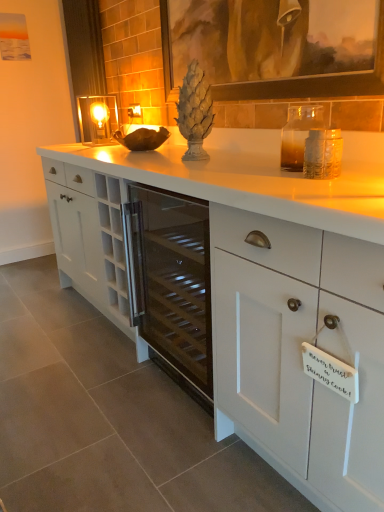
Question: From the image's perspective, does white matte cabinet at center appear lower than matte brown picture frame at upper center?

Choices:
 (A) yes
 (B) no

Answer: (A)

Question: From the image's perspective, is white matte cabinet at center located above matte brown picture frame at upper center?

Choices:
 (A) no
 (B) yes

Answer: (A)

Question: Does white matte cabinet at center have a greater width compared to matte brown picture frame at upper center?

Choices:
 (A) yes
 (B) no

Answer: (A)

Question: From a real-world perspective, is white matte cabinet at center below matte brown picture frame at upper center?

Choices:
 (A) yes
 (B) no

Answer: (A)

Question: Is the surface of white matte cabinet at center in direct contact with matte brown picture frame at upper center?

Choices:
 (A) yes
 (B) no

Answer: (B)

Question: Considering the relative positions of matte glass electric outlet at center and white matte cabinet at center in the image provided, is matte glass electric outlet at center to the left or to the right of white matte cabinet at center?

Choices:
 (A) left
 (B) right

Answer: (A)

Question: From their relative heights in the image, would you say matte glass electric outlet at center is taller or shorter than white matte cabinet at center?

Choices:
 (A) tall
 (B) short

Answer: (B)

Question: From the image's perspective, is matte glass electric outlet at center above or below white matte cabinet at center?

Choices:
 (A) below
 (B) above

Answer: (B)

Question: Is point (130, 109) positioned closer to the camera than point (210, 245)?

Choices:
 (A) closer
 (B) farther

Answer: (B)

Question: In the image, is matte brown picture frame at upper center positioned in front of or behind matte glass candle holder at upper left?

Choices:
 (A) front
 (B) behind

Answer: (A)

Question: Is matte brown picture frame at upper center wider or thinner than matte glass candle holder at upper left?

Choices:
 (A) wide
 (B) thin

Answer: (B)

Question: Based on their positions, is matte brown picture frame at upper center located to the left or right of matte glass candle holder at upper left?

Choices:
 (A) right
 (B) left

Answer: (A)

Question: Looking at the image, does matte brown picture frame at upper center seem bigger or smaller compared to matte glass candle holder at upper left?

Choices:
 (A) big
 (B) small

Answer: (A)

Question: In the image, is matte brown picture frame at upper center positioned in front of or behind white matte cabinet at center?

Choices:
 (A) behind
 (B) front

Answer: (A)

Question: Does point (382, 18) appear closer or farther from the camera than point (365, 458)?

Choices:
 (A) farther
 (B) closer

Answer: (A)